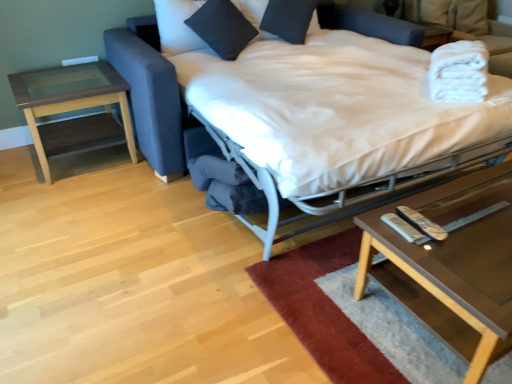
Question: Should I look upward or downward to see white fabric bed at center?

Choices:
 (A) up
 (B) down

Answer: (A)

Question: Is white plastic remote at lower right, the first remote viewed from the left, at the left side of brown wood/glass side table at left?

Choices:
 (A) yes
 (B) no

Answer: (B)

Question: Can you confirm if white plastic remote at lower right, the first remote viewed from the left, is wider than brown wood/glass side table at left?

Choices:
 (A) no
 (B) yes

Answer: (A)

Question: Is white plastic remote at lower right, the second remote viewed from the right, outside of brown wood/glass side table at left?

Choices:
 (A) yes
 (B) no

Answer: (A)

Question: Considering the relative sizes of white plastic remote at lower right, the second remote viewed from the right, and brown wood/glass side table at left in the image provided, is white plastic remote at lower right, the second remote viewed from the right, bigger than brown wood/glass side table at left?

Choices:
 (A) yes
 (B) no

Answer: (B)

Question: Considering the relative sizes of white plastic remote at lower right, the first remote viewed from the left, and brown wood/glass side table at left in the image provided, is white plastic remote at lower right, the first remote viewed from the left, smaller than brown wood/glass side table at left?

Choices:
 (A) no
 (B) yes

Answer: (B)

Question: Would you consider white plastic remote at lower right, the first remote viewed from the left, to be distant from brown wood/glass side table at left?

Choices:
 (A) no
 (B) yes

Answer: (B)

Question: From the image's perspective, does white fabric bed at center appear lower than black cotton pillow at upper center, arranged as the first pillow when viewed from the left?

Choices:
 (A) no
 (B) yes

Answer: (B)

Question: Is white fabric bed at center oriented towards black cotton pillow at upper center, arranged as the first pillow when viewed from the left?

Choices:
 (A) yes
 (B) no

Answer: (B)

Question: Is white fabric bed at center closer to camera compared to black cotton pillow at upper center, which is counted as the second pillow, starting from the right?

Choices:
 (A) no
 (B) yes

Answer: (B)

Question: Can you confirm if white fabric bed at center is wider than black cotton pillow at upper center, which is counted as the second pillow, starting from the right?

Choices:
 (A) yes
 (B) no

Answer: (A)

Question: From the image's perspective, would you say white fabric bed at center is positioned over black cotton pillow at upper center, arranged as the first pillow when viewed from the left?

Choices:
 (A) no
 (B) yes

Answer: (A)

Question: Is the position of white fabric bed at center more distant than that of black cotton pillow at upper center, arranged as the first pillow when viewed from the left?

Choices:
 (A) no
 (B) yes

Answer: (A)

Question: From a real-world perspective, is white fabric bed at center positioned under white plastic remote at lower right, the first remote viewed from the left, based on gravity?

Choices:
 (A) no
 (B) yes

Answer: (B)